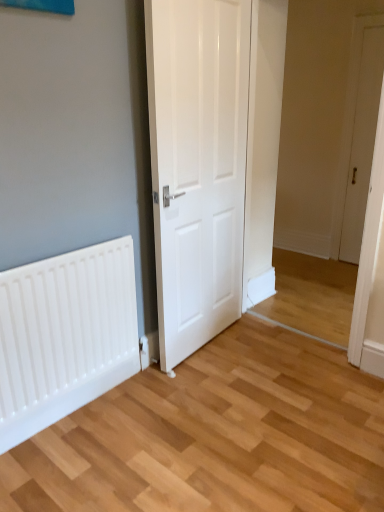
Identify the location of free region under white matte radiator at lower left (from a real-world perspective). This screenshot has width=384, height=512. (90, 404).